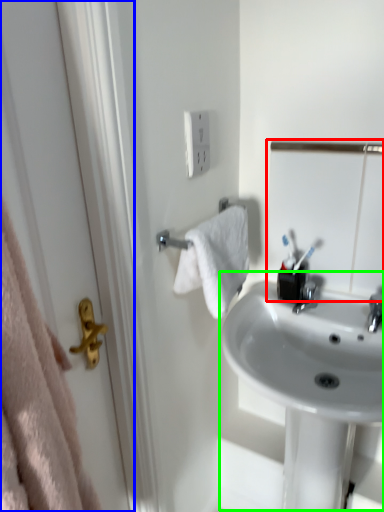
Question: Considering the real-world distances, which object is closest to mirror (highlighted by a red box)? screen door (highlighted by a blue box) or sink (highlighted by a green box).

Choices:
 (A) screen door
 (B) sink

Answer: (B)